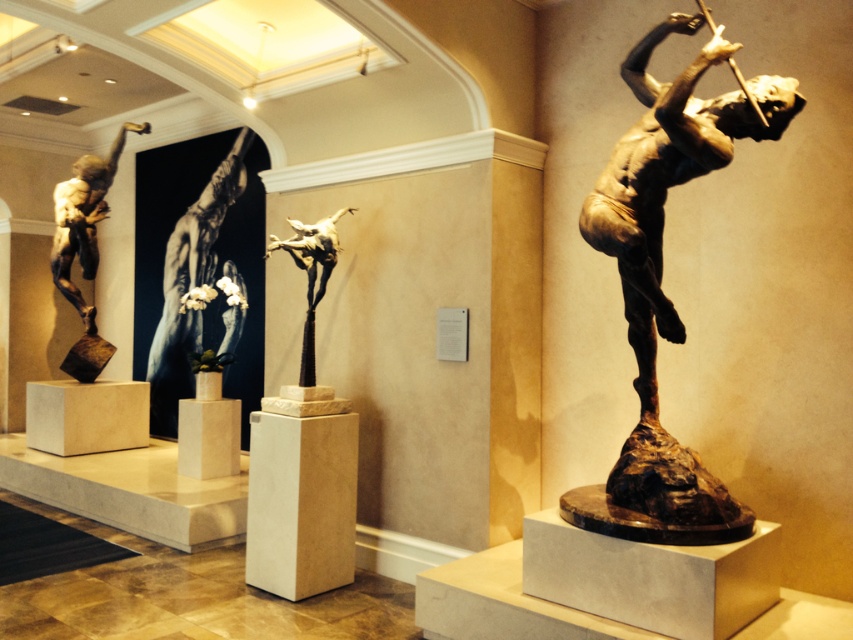
Does bronze statue at right appear over bronze statue at center?

Incorrect, bronze statue at right is not positioned above bronze statue at center.

Is bronze statue at right shorter than bronze statue at center?

Incorrect, bronze statue at right's height does not fall short of bronze statue at center's.

Describe the element at coordinates (660, 282) in the screenshot. I see `bronze statue at right` at that location.

This screenshot has width=853, height=640. I want to click on bronze statue at right, so click(660, 282).

Which is above, bronze statue at left or bronze statue at center?

Positioned higher is bronze statue at left.

Does bronze statue at left have a greater height compared to bronze statue at center?

Yes.

Between point (114, 164) and point (322, 250), which one is positioned in front?

Point (322, 250)

Find the location of a particular element. This screenshot has height=640, width=853. bronze statue at left is located at coordinates (84, 248).

How much distance is there between matte bronze statue at center and bronze statue at center?

A distance of 2.76 meters exists between matte bronze statue at center and bronze statue at center.

Between matte bronze statue at center and bronze statue at center, which one has more height?

matte bronze statue at center

Who is more forward, (172,356) or (306,364)?

Point (306,364) is more forward.

This screenshot has height=640, width=853. I want to click on matte bronze statue at center, so click(189, 285).